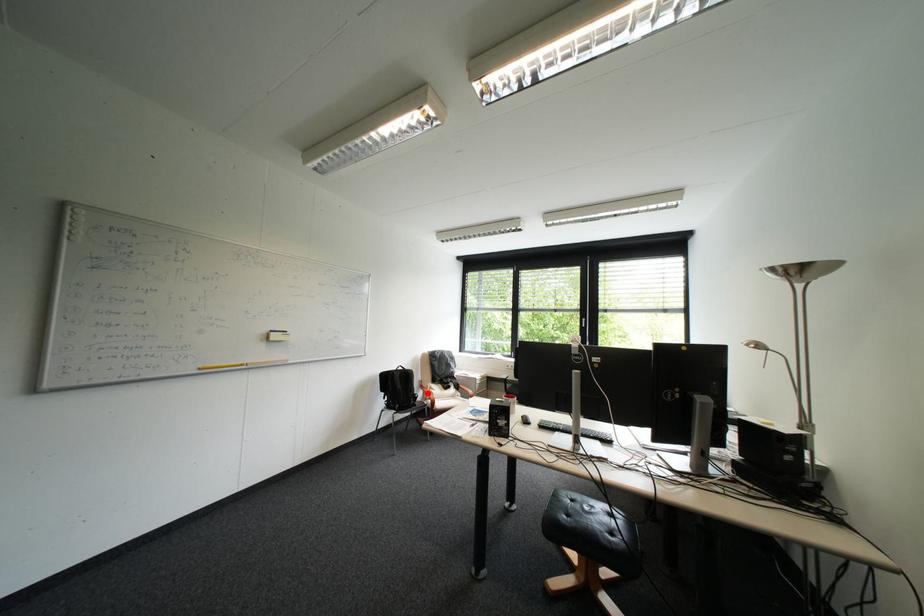
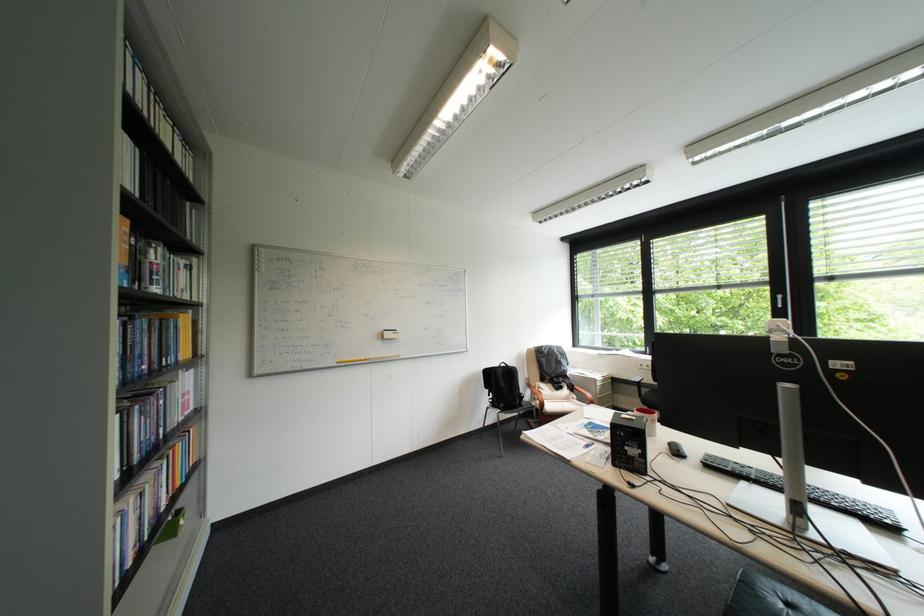
Locate, in the second image, the point that corresponds to the highlighted location in the first image.

(533, 392)